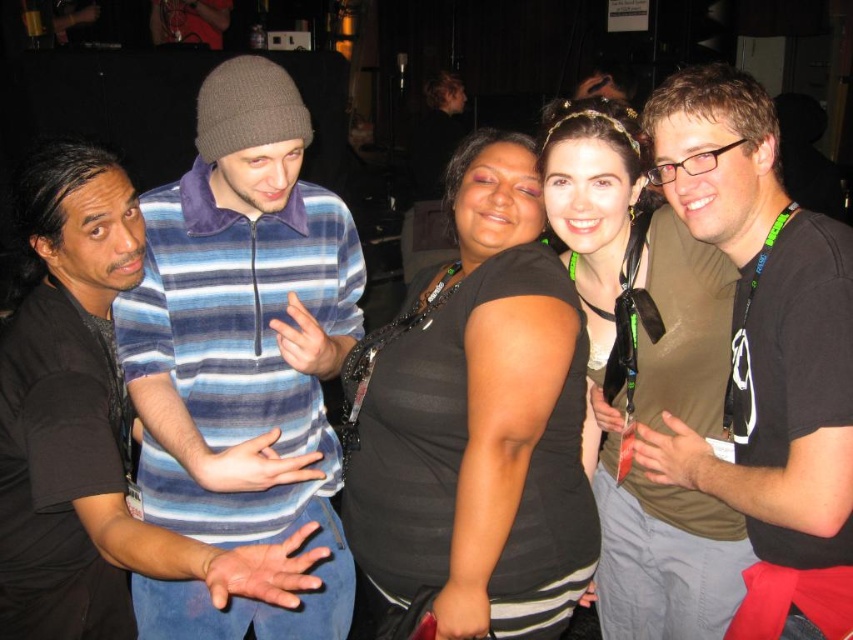
Question: Does striped cotton shirt at left come in front of black matte shirt at center?

Choices:
 (A) yes
 (B) no

Answer: (A)

Question: Among these objects, which one is nearest to the camera?

Choices:
 (A) black matte shirt at center
 (B) matte black shirt at right

Answer: (B)

Question: Can you confirm if black matte shirt at center is wider than matte black shirt at center?

Choices:
 (A) no
 (B) yes

Answer: (B)

Question: Among these objects, which one is farthest from the camera?

Choices:
 (A) black matte shirt at center
 (B) striped cotton shirt at left

Answer: (A)

Question: Among these points, which one is farthest from the camera?

Choices:
 (A) (520, 401)
 (B) (146, 339)

Answer: (B)

Question: Where is matte black shirt at right located in relation to matte black shirt at center in the image?

Choices:
 (A) right
 (B) left

Answer: (A)